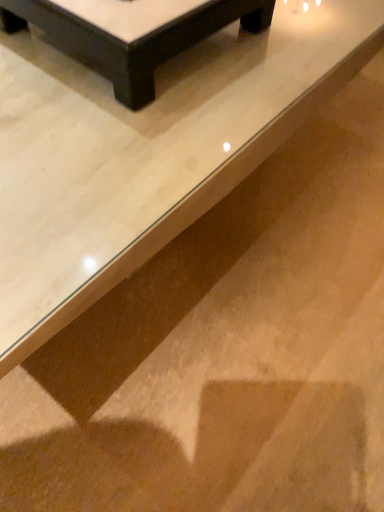
Measure the distance between point (14, 14) and camera.

A distance of 29.92 inches exists between point (14, 14) and camera.

What do you see at coordinates (136, 39) in the screenshot?
I see `black glossy table at upper center, which is counted as the first table, starting from the back` at bounding box center [136, 39].

The height and width of the screenshot is (512, 384). What are the coordinates of `black glossy table at upper center, which is counted as the first table, starting from the back` in the screenshot? It's located at (136, 39).

Describe the element at coordinates (145, 152) in the screenshot. I see `white glossy table at upper center, which is the second table from back to front` at that location.

Locate an element on the screen. The image size is (384, 512). white glossy table at upper center, which is the second table from back to front is located at coordinates (145, 152).

In order to face white glossy table at upper center, which is the second table from back to front, should I rotate leftwards or rightwards?

Turn left approximately 7.335 degrees to face it.

How much space does white glossy table at upper center, which is counted as the first table, starting from the front, occupy vertically?

42.26 centimeters.

You are a GUI agent. You are given a task and a screenshot of the screen. Output one action in this format:
    pyautogui.click(x=<x>, y=<y>)
    Task: Click on the black glossy table at upper center, the second table when ordered from front to back
    
    Given the screenshot: What is the action you would take?
    pyautogui.click(x=136, y=39)

Considering the relative positions of black glossy table at upper center, which is counted as the first table, starting from the back, and white glossy table at upper center, which is the second table from back to front, in the image provided, is black glossy table at upper center, which is counted as the first table, starting from the back, to the left or to the right of white glossy table at upper center, which is the second table from back to front,?

black glossy table at upper center, which is counted as the first table, starting from the back, is to the right of white glossy table at upper center, which is the second table from back to front.

Is black glossy table at upper center, which is counted as the first table, starting from the back, closer to camera compared to white glossy table at upper center, which is the second table from back to front?

No, the depth of black glossy table at upper center, which is counted as the first table, starting from the back, is greater than that of white glossy table at upper center, which is the second table from back to front.

Between point (88, 22) and point (56, 254), which one is positioned in front?

Point (56, 254)

From the image's perspective, is black glossy table at upper center, the second table when ordered from front to back, located above or below white glossy table at upper center, which is counted as the first table, starting from the front?

black glossy table at upper center, the second table when ordered from front to back, is situated higher than white glossy table at upper center, which is counted as the first table, starting from the front, in the image.

From a real-world perspective, does black glossy table at upper center, which is counted as the first table, starting from the back, sit lower than white glossy table at upper center, which is counted as the first table, starting from the front?

No.

In terms of width, does black glossy table at upper center, which is counted as the first table, starting from the back, look wider or thinner when compared to white glossy table at upper center, which is counted as the first table, starting from the front?

Considering their sizes, black glossy table at upper center, which is counted as the first table, starting from the back, looks slimmer than white glossy table at upper center, which is counted as the first table, starting from the front.

Can you confirm if black glossy table at upper center, the second table when ordered from front to back, is taller than white glossy table at upper center, which is the second table from back to front?

No, black glossy table at upper center, the second table when ordered from front to back, is not taller than white glossy table at upper center, which is the second table from back to front.

Is black glossy table at upper center, the second table when ordered from front to back, smaller than white glossy table at upper center, which is counted as the first table, starting from the front?

Correct, black glossy table at upper center, the second table when ordered from front to back, occupies less space than white glossy table at upper center, which is counted as the first table, starting from the front.

Do you think black glossy table at upper center, the second table when ordered from front to back, is within white glossy table at upper center, which is counted as the first table, starting from the front, or outside of it?

black glossy table at upper center, the second table when ordered from front to back, is spatially situated outside white glossy table at upper center, which is counted as the first table, starting from the front.

Can you see black glossy table at upper center, the second table when ordered from front to back, touching white glossy table at upper center, which is counted as the first table, starting from the front?

No, black glossy table at upper center, the second table when ordered from front to back, is not beside white glossy table at upper center, which is counted as the first table, starting from the front.

Is black glossy table at upper center, which is counted as the first table, starting from the back, oriented towards white glossy table at upper center, which is counted as the first table, starting from the front?

No, black glossy table at upper center, which is counted as the first table, starting from the back, is not aimed at white glossy table at upper center, which is counted as the first table, starting from the front.

Can you tell me how much black glossy table at upper center, which is counted as the first table, starting from the back, and white glossy table at upper center, which is the second table from back to front, differ in facing direction?

2.5 degrees.

Measure the distance between black glossy table at upper center, which is counted as the first table, starting from the back, and white glossy table at upper center, which is counted as the first table, starting from the front.

They are 4.65 inches apart.

Image resolution: width=384 pixels, height=512 pixels. I want to click on table in front of the black glossy table at upper center, which is counted as the first table, starting from the back, so click(145, 152).

Which is more to the right, white glossy table at upper center, which is the second table from back to front, or black glossy table at upper center, the second table when ordered from front to back?

Positioned to the right is black glossy table at upper center, the second table when ordered from front to back.

Between white glossy table at upper center, which is counted as the first table, starting from the front, and black glossy table at upper center, the second table when ordered from front to back, which one is positioned behind?

black glossy table at upper center, the second table when ordered from front to back, is further away from the camera.

Is point (317, 40) positioned before point (124, 99)?

No, it is behind (124, 99).

From the image's perspective, is white glossy table at upper center, which is the second table from back to front, located beneath black glossy table at upper center, the second table when ordered from front to back?

Correct, white glossy table at upper center, which is the second table from back to front, appears lower than black glossy table at upper center, the second table when ordered from front to back, in the image.

From a real-world perspective, which is physically below, white glossy table at upper center, which is the second table from back to front, or black glossy table at upper center, which is counted as the first table, starting from the back?

In real-world perspective, white glossy table at upper center, which is the second table from back to front, is lower.

Is white glossy table at upper center, which is counted as the first table, starting from the front, wider than black glossy table at upper center, the second table when ordered from front to back?

Indeed, white glossy table at upper center, which is counted as the first table, starting from the front, has a greater width compared to black glossy table at upper center, the second table when ordered from front to back.

Is white glossy table at upper center, which is the second table from back to front, taller than black glossy table at upper center, which is counted as the first table, starting from the back?

Indeed, white glossy table at upper center, which is the second table from back to front, has a greater height compared to black glossy table at upper center, which is counted as the first table, starting from the back.

Is white glossy table at upper center, which is the second table from back to front, bigger or smaller than black glossy table at upper center, which is counted as the first table, starting from the back?

Clearly, white glossy table at upper center, which is the second table from back to front, is larger in size than black glossy table at upper center, which is counted as the first table, starting from the back.

Looking at this image, could black glossy table at upper center, the second table when ordered from front to back, be considered to be inside white glossy table at upper center, which is counted as the first table, starting from the front?

No, black glossy table at upper center, the second table when ordered from front to back, is not a part of white glossy table at upper center, which is counted as the first table, starting from the front.

Is white glossy table at upper center, which is counted as the first table, starting from the front, far away from black glossy table at upper center, the second table when ordered from front to back?

Actually, white glossy table at upper center, which is counted as the first table, starting from the front, and black glossy table at upper center, the second table when ordered from front to back, are a little close together.

Is white glossy table at upper center, which is the second table from back to front, positioned with its back to black glossy table at upper center, which is counted as the first table, starting from the back?

No.

Where is `table below the black glossy table at upper center, the second table when ordered from front to back (from the image's perspective)`? The height and width of the screenshot is (512, 384). table below the black glossy table at upper center, the second table when ordered from front to back (from the image's perspective) is located at coordinates [x=145, y=152].

You are a GUI agent. You are given a task and a screenshot of the screen. Output one action in this format:
    pyautogui.click(x=<x>, y=<y>)
    Task: Click on the table beneath the black glossy table at upper center, the second table when ordered from front to back (from a real-world perspective)
    Image resolution: width=384 pixels, height=512 pixels.
    Given the screenshot: What is the action you would take?
    click(145, 152)

This screenshot has height=512, width=384. In order to click on table on the right of the white glossy table at upper center, which is the second table from back to front in this screenshot , I will do `click(136, 39)`.